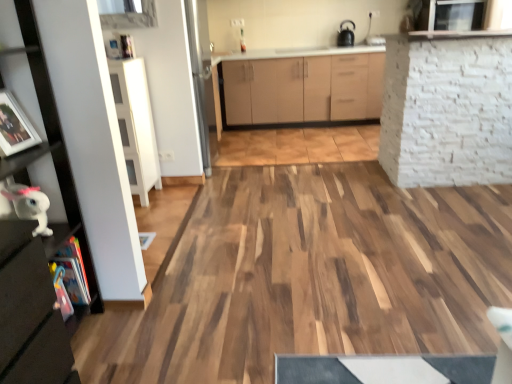
The image size is (512, 384). What do you see at coordinates (373, 40) in the screenshot? I see `white glossy sink at upper center` at bounding box center [373, 40].

What do you see at coordinates (346, 35) in the screenshot? I see `black matte kettle at upper center` at bounding box center [346, 35].

What is the approximate height of matte wood cabinetry at center, arranged as the second cabinetry when viewed from the front?

It is 34.39 inches.

Describe the element at coordinates (14, 127) in the screenshot. I see `matte white picture frame at left` at that location.

In order to face matte black shelf at left, the 2th cabinetry viewed from the right, should I rotate leftwards or rightwards?

Turn left approximately 30.898 degrees to face it.

Image resolution: width=512 pixels, height=384 pixels. What do you see at coordinates (31, 222) in the screenshot?
I see `matte black shelf at left, marked as the 1th cabinetry in a front-to-back arrangement` at bounding box center [31, 222].

Find the location of a particular element. The image size is (512, 384). white brick wall at upper right is located at coordinates (447, 111).

Locate an element on the screen. Image resolution: width=512 pixels, height=384 pixels. white glossy sink at upper center is located at coordinates (373, 40).

Does white glossy sink at upper center turn towards matte wood cabinetry at center, which ranks as the 2th cabinetry in left-to-right order?

No, white glossy sink at upper center is not oriented towards matte wood cabinetry at center, which ranks as the 2th cabinetry in left-to-right order.

From the image's perspective, is white glossy sink at upper center located above or below matte wood cabinetry at center, which ranks as the 1th cabinetry in top-to-bottom order?

Clearly, from the image's perspective, white glossy sink at upper center is above matte wood cabinetry at center, which ranks as the 1th cabinetry in top-to-bottom order.

From a real-world perspective, between white glossy sink at upper center and matte wood cabinetry at center, arranged as the second cabinetry when viewed from the front, who is vertically higher?

white glossy sink at upper center, from a real-world perspective.

Who is taller, white glossy sink at upper center or matte wood cabinetry at center, which ranks as the 1th cabinetry in top-to-bottom order?

With more height is matte wood cabinetry at center, which ranks as the 1th cabinetry in top-to-bottom order.

Which object is wider, white glossy plush toy at lower left or matte black shelf at left, marked as the 1th cabinetry in a front-to-back arrangement?

Wider between the two is matte black shelf at left, marked as the 1th cabinetry in a front-to-back arrangement.

From the picture: Is white glossy plush toy at lower left surrounding matte black shelf at left, marked as the second cabinetry in a back-to-front arrangement?

Actually, matte black shelf at left, marked as the second cabinetry in a back-to-front arrangement, is outside white glossy plush toy at lower left.

Can you confirm if white glossy plush toy at lower left is positioned to the right of matte black shelf at left, the 2th cabinetry viewed from the right?

Yes.

Is white glossy plush toy at lower left oriented away from matte black shelf at left, positioned as the 1th cabinetry in left-to-right order?

Yes, white glossy plush toy at lower left is positioned with its back facing matte black shelf at left, positioned as the 1th cabinetry in left-to-right order.

From a real-world perspective, is matte wood cabinetry at center, arranged as the second cabinetry when viewed from the front, over matte white picture frame at left?

No, from a real-world perspective, matte wood cabinetry at center, arranged as the second cabinetry when viewed from the front, is not above matte white picture frame at left.

Considering the sizes of objects matte wood cabinetry at center, which ranks as the 2th cabinetry in left-to-right order, and matte white picture frame at left in the image provided, who is bigger, matte wood cabinetry at center, which ranks as the 2th cabinetry in left-to-right order, or matte white picture frame at left?

Bigger between the two is matte wood cabinetry at center, which ranks as the 2th cabinetry in left-to-right order.

Is matte wood cabinetry at center, arranged as the second cabinetry when viewed from the front, positioned far away from matte white picture frame at left?

That's right, there is a large distance between matte wood cabinetry at center, arranged as the second cabinetry when viewed from the front, and matte white picture frame at left.

Which is correct: matte wood cabinetry at center, arranged as the second cabinetry when viewed from the front, is inside matte white picture frame at left, or outside of it?

matte wood cabinetry at center, arranged as the second cabinetry when viewed from the front, is not inside matte white picture frame at left, it's outside.

Between white glossy sink at upper center and matte black shelf at left, marked as the second cabinetry in a back-to-front arrangement, which one has more height?

With more height is matte black shelf at left, marked as the second cabinetry in a back-to-front arrangement.

Based on their positions, is white glossy sink at upper center located to the left or right of matte black shelf at left, marked as the 1th cabinetry in a front-to-back arrangement?

In the image, white glossy sink at upper center appears on the right side of matte black shelf at left, marked as the 1th cabinetry in a front-to-back arrangement.

From a real-world perspective, between white glossy sink at upper center and matte black shelf at left, positioned as the first cabinetry in bottom-to-top order, who is vertically lower?

matte black shelf at left, positioned as the first cabinetry in bottom-to-top order.

Which is less distant, (375, 41) or (7, 19)?

Point (375, 41) is farther from the camera than point (7, 19).

Is matte black shelf at left, marked as the second cabinetry in a back-to-front arrangement, inside black matte kettle at upper center?

No, matte black shelf at left, marked as the second cabinetry in a back-to-front arrangement, is not surrounded by black matte kettle at upper center.

Locate an element on the screen. This screenshot has height=384, width=512. cabinetry that is the 2nd object to the left of the black matte kettle at upper center, starting at the anchor is located at coordinates (31, 222).

Is black matte kettle at upper center to the left or to the right of matte black shelf at left, marked as the 1th cabinetry in a front-to-back arrangement, in the image?

black matte kettle at upper center is positioned on matte black shelf at left, marked as the 1th cabinetry in a front-to-back arrangement,'s right side.

From the image's perspective, who appears lower, matte wood cabinetry at center, which ranks as the 1th cabinetry in top-to-bottom order, or white glossy sink at upper center?

matte wood cabinetry at center, which ranks as the 1th cabinetry in top-to-bottom order, is shown below in the image.

Is matte wood cabinetry at center, which is the first cabinetry from back to front, facing away from white glossy sink at upper center?

No, white glossy sink at upper center is not at the back of matte wood cabinetry at center, which is the first cabinetry from back to front.

Is matte wood cabinetry at center, the 2th cabinetry ordered from the bottom, wider than white glossy sink at upper center?

Indeed, matte wood cabinetry at center, the 2th cabinetry ordered from the bottom, has a greater width compared to white glossy sink at upper center.

Is black matte kettle at upper center situated inside matte white picture frame at left or outside?

black matte kettle at upper center is located beyond the bounds of matte white picture frame at left.

Which object is positioned more to the left, black matte kettle at upper center or matte white picture frame at left?

matte white picture frame at left is more to the left.

Could you tell me if black matte kettle at upper center is turned towards matte white picture frame at left?

No, black matte kettle at upper center is not turned towards matte white picture frame at left.

Where is `the 2nd cabinetry located beneath the white glossy sink at upper center (from a real-world perspective)`? The image size is (512, 384). the 2nd cabinetry located beneath the white glossy sink at upper center (from a real-world perspective) is located at coordinates (303, 85).

The height and width of the screenshot is (384, 512). Identify the location of toy behind the matte black shelf at left, positioned as the first cabinetry in bottom-to-top order. (29, 205).

Estimate the real-world distances between objects in this image. Which object is closer to black matte kettle at upper center, matte white picture frame at left or matte wood cabinetry at center, arranged as the second cabinetry when viewed from the front?

Among the two, matte wood cabinetry at center, arranged as the second cabinetry when viewed from the front, is located nearer to black matte kettle at upper center.

Estimate the real-world distances between objects in this image. Which object is closer to white brick wall at upper right, white glossy plush toy at lower left or matte white picture frame at left?

matte white picture frame at left lies closer to white brick wall at upper right than the other object.

From the image, which object appears to be nearer to white brick wall at upper right, matte white picture frame at left or black matte kettle at upper center?

The object closer to white brick wall at upper right is matte white picture frame at left.

Looking at the image, which one is located further to matte white picture frame at left, matte black shelf at left, acting as the 2th cabinetry starting from the top, or white brick wall at upper right?

white brick wall at upper right is further to matte white picture frame at left.

Considering their positions, is white glossy plush toy at lower left positioned further to white glossy sink at upper center than matte black shelf at left, the 2th cabinetry viewed from the right?

white glossy plush toy at lower left is further to white glossy sink at upper center.

When comparing their distances from matte black shelf at left, marked as the second cabinetry in a back-to-front arrangement, does black matte kettle at upper center or white glossy plush toy at lower left seem further?

Based on the image, black matte kettle at upper center appears to be further to matte black shelf at left, marked as the second cabinetry in a back-to-front arrangement.

Based on their spatial positions, is white glossy sink at upper center or white glossy plush toy at lower left closer to white brick wall at upper right?

white glossy sink at upper center is closer to white brick wall at upper right.

Looking at the image, which one is located further to white brick wall at upper right, white glossy sink at upper center or black matte kettle at upper center?

black matte kettle at upper center lies further to white brick wall at upper right than the other object.

Find the location of a particular element. Image resolution: width=512 pixels, height=384 pixels. sink positioned between matte black shelf at left, positioned as the first cabinetry in bottom-to-top order, and black matte kettle at upper center from near to far is located at coordinates (373, 40).

Find the location of a particular element. The width and height of the screenshot is (512, 384). toy between matte white picture frame at left and matte wood cabinetry at center, the 1th cabinetry positioned from the right, along the z-axis is located at coordinates [29, 205].

I want to click on cabinetry between white brick wall at upper right and white glossy sink at upper center along the z-axis, so click(303, 85).

Locate an element on the screen. The width and height of the screenshot is (512, 384). picture frame positioned between matte black shelf at left, positioned as the first cabinetry in bottom-to-top order, and black matte kettle at upper center from near to far is located at coordinates (14, 127).